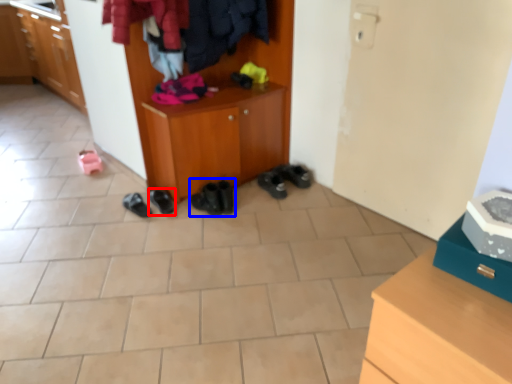
Question: Among these objects, which one is nearest to the camera, footwear (highlighted by a red box) or footwear (highlighted by a blue box)?

Choices:
 (A) footwear
 (B) footwear

Answer: (B)